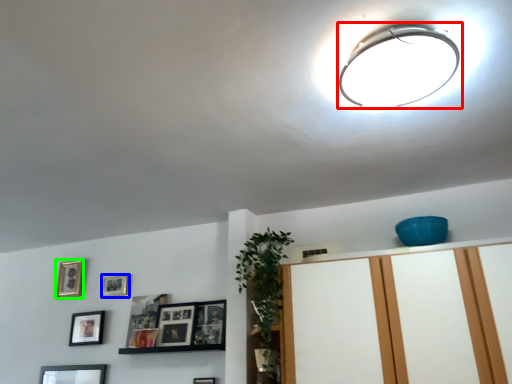
Question: Estimate the real-world distances between objects in this image. Which object is closer to lamp (highlighted by a red box), picture frame (highlighted by a blue box) or picture frame (highlighted by a green box)?

Choices:
 (A) picture frame
 (B) picture frame

Answer: (A)